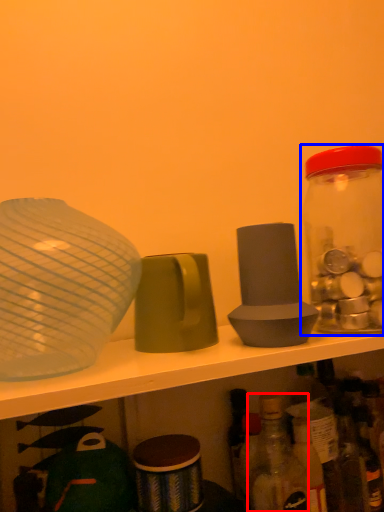
Question: Which object appears farthest to the camera in this image, bottle (highlighted by a red box) or bottle (highlighted by a blue box)?

Choices:
 (A) bottle
 (B) bottle

Answer: (B)